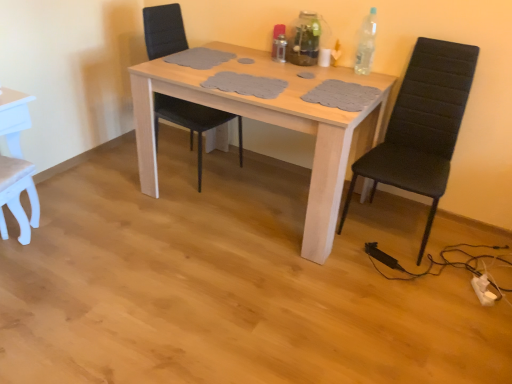
The image size is (512, 384). Find the location of `vacant space that's between light wood table at center and black fabric chair at right, marked as the 3th chair in a left-to-right arrangement`. vacant space that's between light wood table at center and black fabric chair at right, marked as the 3th chair in a left-to-right arrangement is located at coordinates (362, 259).